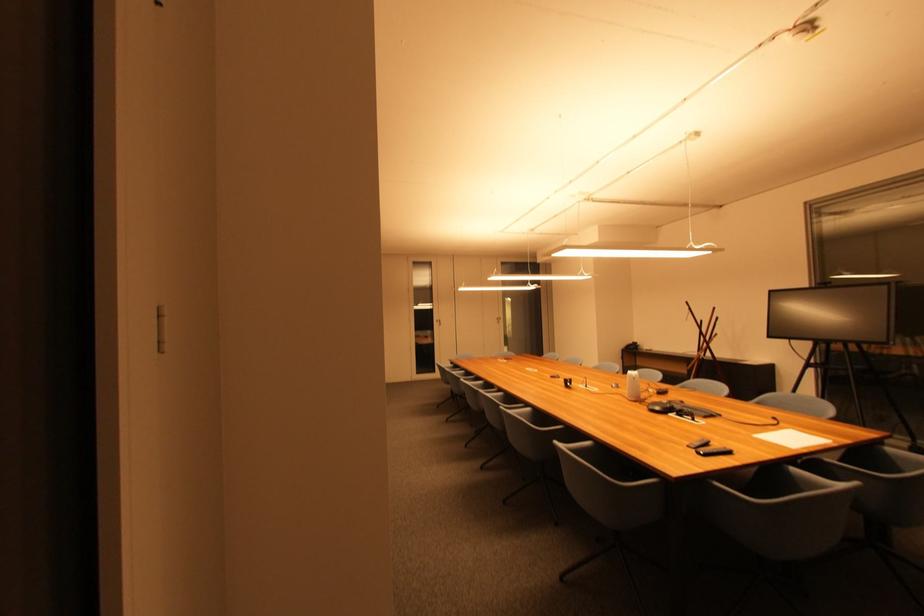
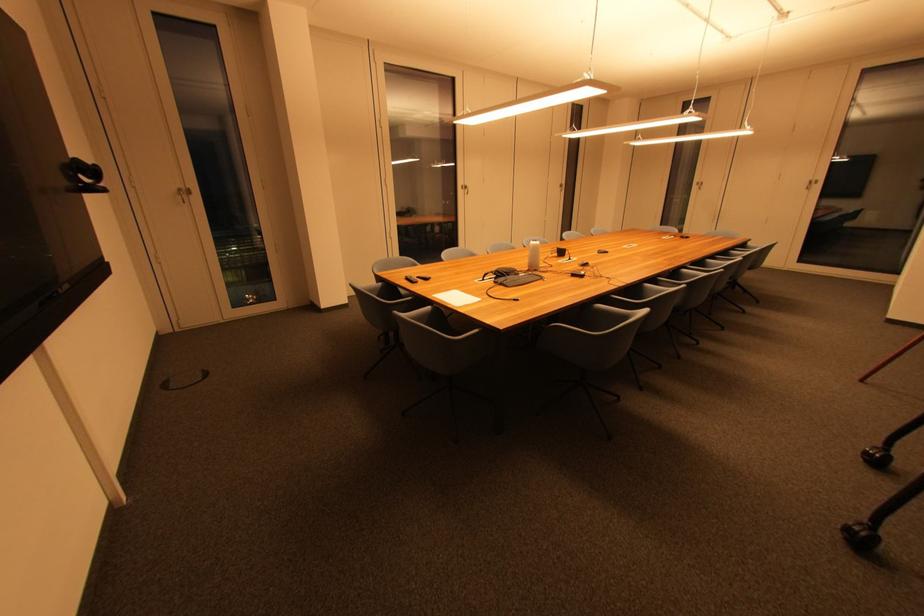
Find the pixel in the second image that matches point 710,419 in the first image.

(500, 285)